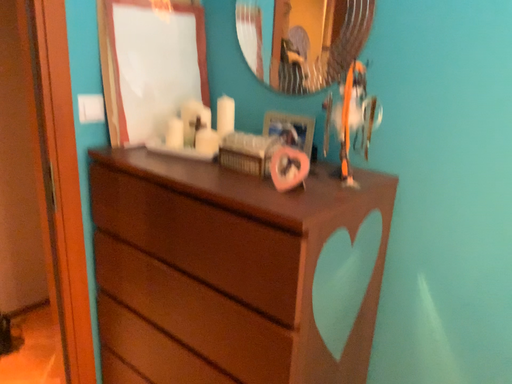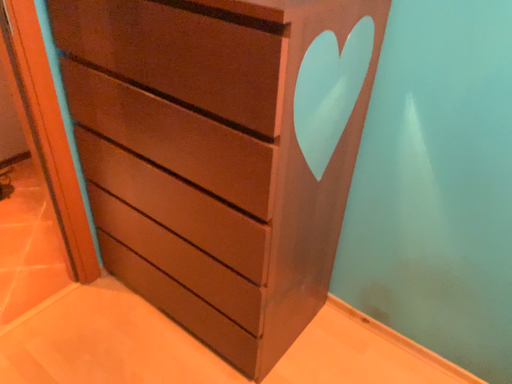
Question: Which way did the camera rotate in the video?

Choices:
 (A) rotated upward
 (B) rotated downward

Answer: (B)